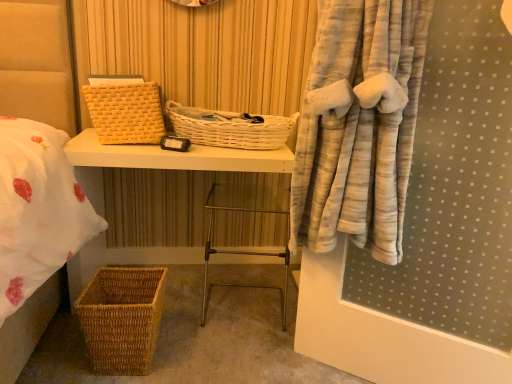
Where is `vacant point to the right of woven brown basket at lower left, which is the 3th basket in top-to-bottom order`? This screenshot has width=512, height=384. vacant point to the right of woven brown basket at lower left, which is the 3th basket in top-to-bottom order is located at coordinates (191, 355).